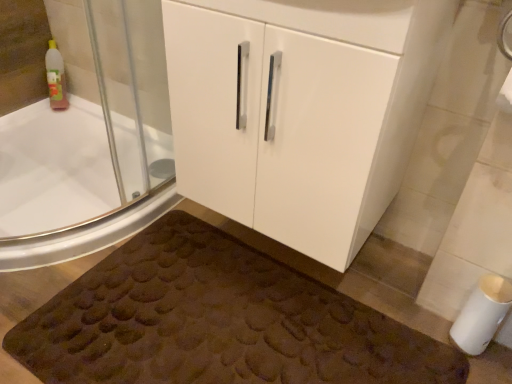
Locate an element on the screen. The image size is (512, 384). empty space that is ontop of brown textured bath mat at lower center is located at coordinates (208, 316).